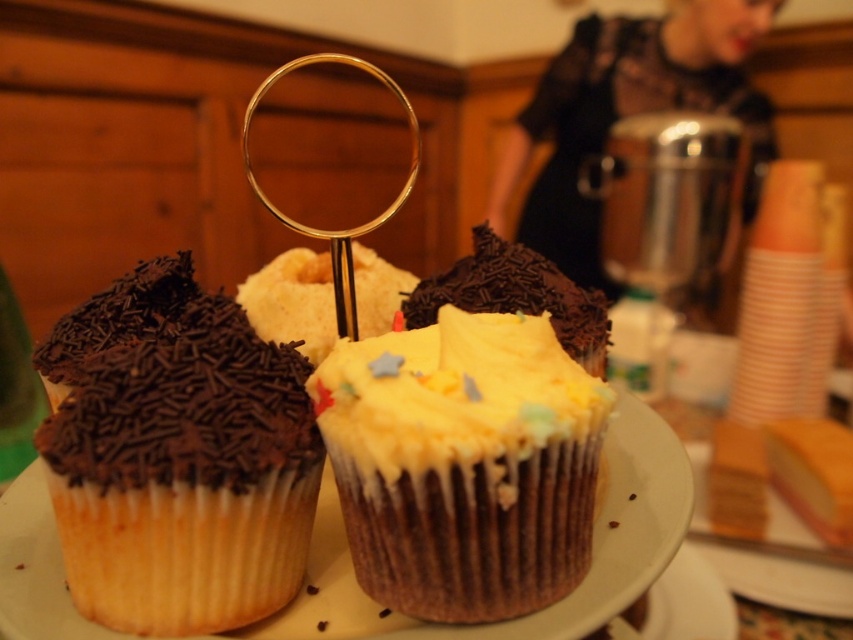
What do you see at coordinates (184, 477) in the screenshot?
I see `chocolate sprinkled cupcake at left` at bounding box center [184, 477].

Is chocolate sprinkled cupcake at left bigger than yellow frosted cupcake at center?

Actually, chocolate sprinkled cupcake at left might be smaller than yellow frosted cupcake at center.

Measure the distance between point (166,371) and camera.

Point (166,371) and camera are 17.97 inches apart.

Where is `chocolate sprinkled cupcake at left`? The height and width of the screenshot is (640, 853). chocolate sprinkled cupcake at left is located at coordinates (x=184, y=477).

Can you confirm if yellow frosting cupcake at center is positioned below gold metallic magnifying glass at center?

Yes.

Is yellow frosting cupcake at center taller than gold metallic magnifying glass at center?

No, yellow frosting cupcake at center is not taller than gold metallic magnifying glass at center.

Between point (454, 394) and point (292, 211), which one is positioned in front?

Point (454, 394) is in front.

Image resolution: width=853 pixels, height=640 pixels. What are the coordinates of `yellow frosting cupcake at center` in the screenshot? It's located at (463, 464).

Does matte chocolate muffin at center appear on the right side of black lace dress at upper center?

In fact, matte chocolate muffin at center is to the left of black lace dress at upper center.

Does matte chocolate muffin at center have a greater height compared to black lace dress at upper center?

No.

The image size is (853, 640). Identify the location of matte chocolate muffin at center. coord(233,408).

You are a GUI agent. You are given a task and a screenshot of the screen. Output one action in this format:
    pyautogui.click(x=<x>, y=<y>)
    Task: Click on the matte chocolate muffin at center
    
    Given the screenshot: What is the action you would take?
    pyautogui.click(x=233, y=408)